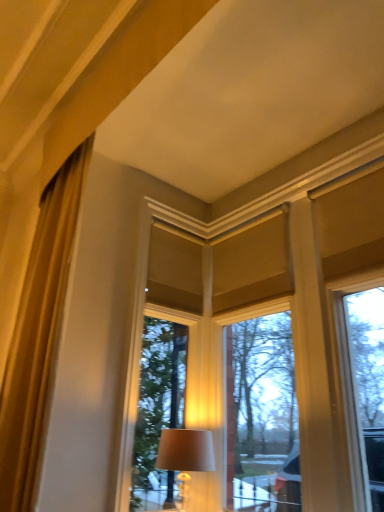
Question: Does matte beige lampshade at center have a lesser width compared to matte cream window at center?

Choices:
 (A) yes
 (B) no

Answer: (B)

Question: Considering the relative sizes of matte beige lampshade at center and matte cream window at center in the image provided, is matte beige lampshade at center bigger than matte cream window at center?

Choices:
 (A) no
 (B) yes

Answer: (A)

Question: Would you consider matte beige lampshade at center to be distant from matte cream window at center?

Choices:
 (A) yes
 (B) no

Answer: (B)

Question: Does matte beige lampshade at center turn towards matte cream window at center?

Choices:
 (A) yes
 (B) no

Answer: (B)

Question: Considering the relative sizes of matte beige lampshade at center and matte cream window at center in the image provided, is matte beige lampshade at center smaller than matte cream window at center?

Choices:
 (A) no
 (B) yes

Answer: (B)

Question: From a real-world perspective, is matte beige lampshade at center located beneath matte cream window at center?

Choices:
 (A) no
 (B) yes

Answer: (B)

Question: Does gold silky curtain at left have a lesser height compared to matte cream window at center?

Choices:
 (A) yes
 (B) no

Answer: (A)

Question: Is matte cream window at center a part of gold silky curtain at left?

Choices:
 (A) yes
 (B) no

Answer: (B)

Question: Could you tell me if gold silky curtain at left is facing matte cream window at center?

Choices:
 (A) no
 (B) yes

Answer: (A)

Question: Does gold silky curtain at left have a larger size compared to matte cream window at center?

Choices:
 (A) yes
 (B) no

Answer: (B)

Question: Is gold silky curtain at left positioned before matte cream window at center?

Choices:
 (A) yes
 (B) no

Answer: (A)

Question: Can you confirm if gold silky curtain at left is wider than matte cream window at center?

Choices:
 (A) no
 (B) yes

Answer: (B)

Question: From the image's perspective, would you say matte beige lampshade at center is positioned over gold silky curtain at left?

Choices:
 (A) no
 (B) yes

Answer: (A)